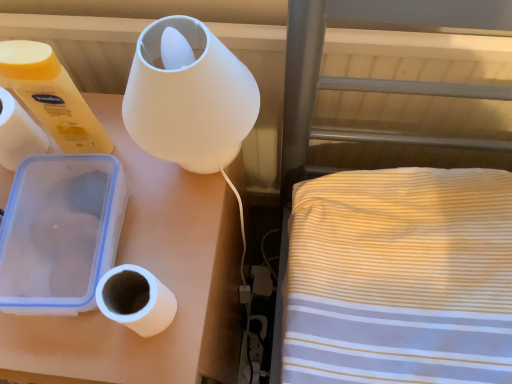
Image resolution: width=512 pixels, height=384 pixels. Identify the location of vacant space in front of frosted glass lamp at upper center. (167, 275).